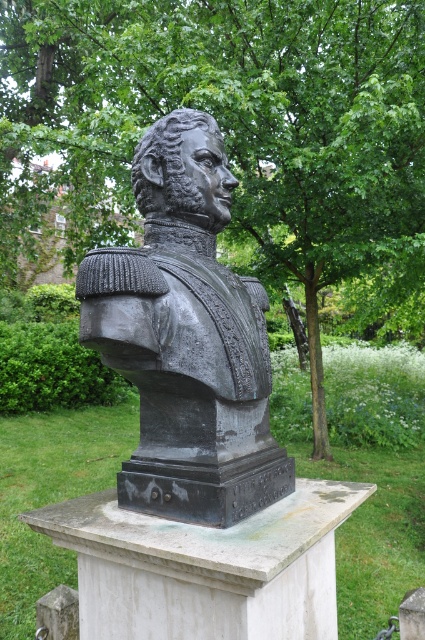
Does point (413, 157) lie behind point (241, 339)?

Yes, point (413, 157) is farther from viewer.

Does green leafy tree at center have a lesser width compared to black polished bust at center?

Correct, green leafy tree at center's width is less than black polished bust at center's.

Where is `green leafy tree at center`? Image resolution: width=425 pixels, height=640 pixels. green leafy tree at center is located at coordinates (229, 124).

At what (x,y) coordinates should I click in order to perform the action: click on green leafy tree at center. Please return your answer as a coordinate pair (x, y). The image size is (425, 640). Looking at the image, I should click on (229, 124).